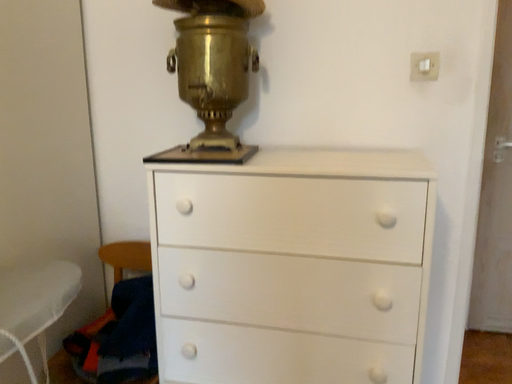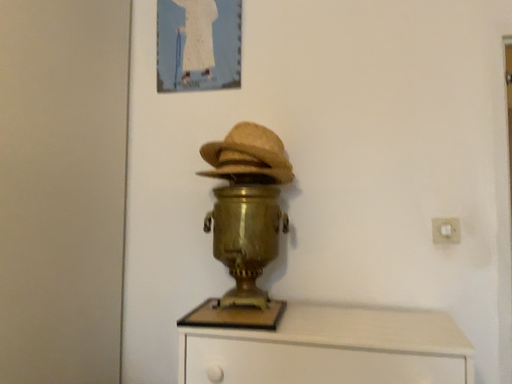
Question: Which way did the camera rotate in the video?

Choices:
 (A) rotated upward
 (B) rotated downward

Answer: (A)